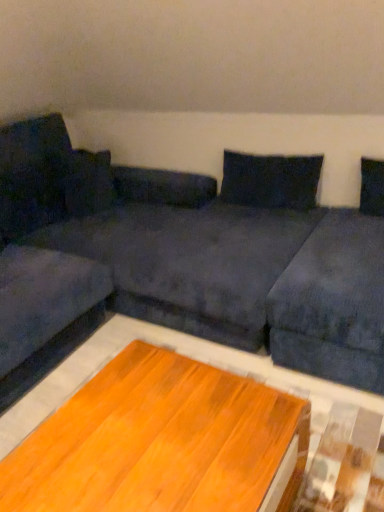
Where is `free spot above wooden table at center (from a real-world perspective)`? The width and height of the screenshot is (384, 512). free spot above wooden table at center (from a real-world perspective) is located at coordinates (146, 434).